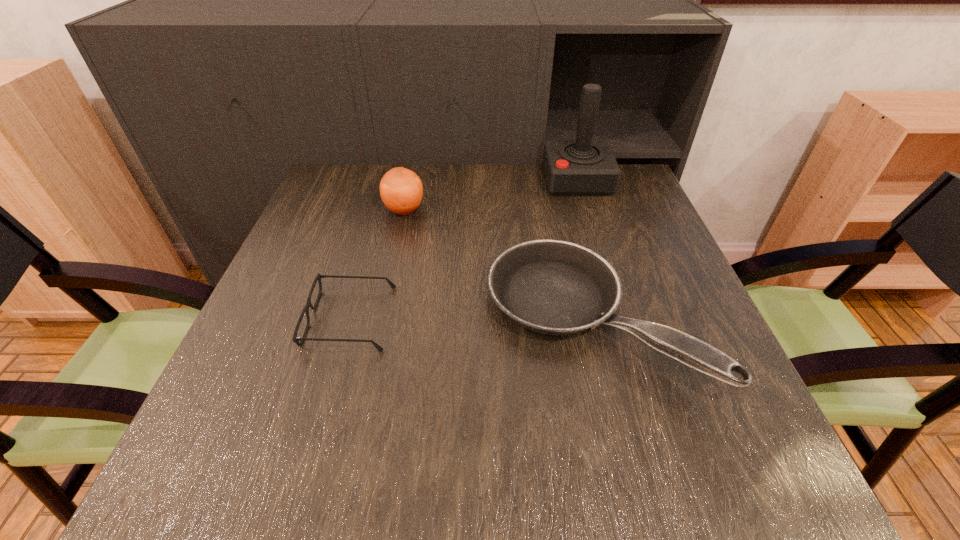
You are a GUI agent. You are given a task and a screenshot of the screen. Output one action in this format:
    pyautogui.click(x=<x>, y=<y>)
    Task: Click on the vacant space located 0.250m on the left of the second shortest object
    The image size is (960, 540).
    Given the screenshot: What is the action you would take?
    pyautogui.click(x=359, y=320)

You are a GUI agent. You are given a task and a screenshot of the screen. Output one action in this format:
    pyautogui.click(x=<x>, y=<y>)
    Task: Click on the free space located on the front-facing side of the spectacles
    The image size is (960, 540).
    Given the screenshot: What is the action you would take?
    pyautogui.click(x=265, y=318)

Locate an element on the screen. vacant space located 0.110m on the front-facing side of the spectacles is located at coordinates (254, 318).

What are the coordinates of `joystick at the far edge` in the screenshot? It's located at (583, 167).

The image size is (960, 540). I want to click on orange that is at the far edge, so (401, 190).

Where is `object present at the left edge`? This screenshot has width=960, height=540. object present at the left edge is located at coordinates (296, 339).

Where is `joystick situated at the right edge`? This screenshot has width=960, height=540. joystick situated at the right edge is located at coordinates (583, 167).

This screenshot has width=960, height=540. Find the location of `frying pan that is at the right edge`. frying pan that is at the right edge is located at coordinates (554, 287).

Identify the location of object that is at the far right corner. (583, 167).

Locate an element on the screen. The width and height of the screenshot is (960, 540). vacant space at the far edge is located at coordinates (459, 178).